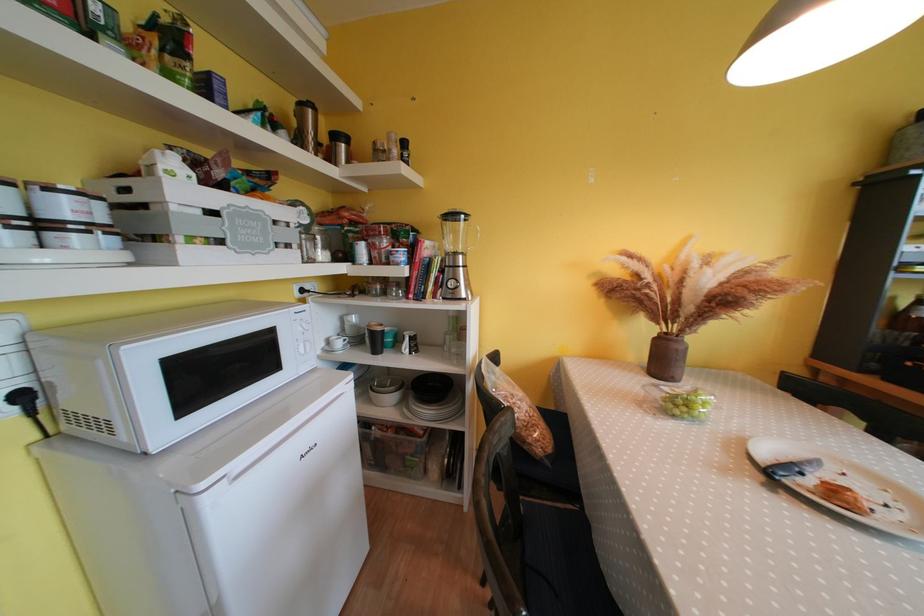
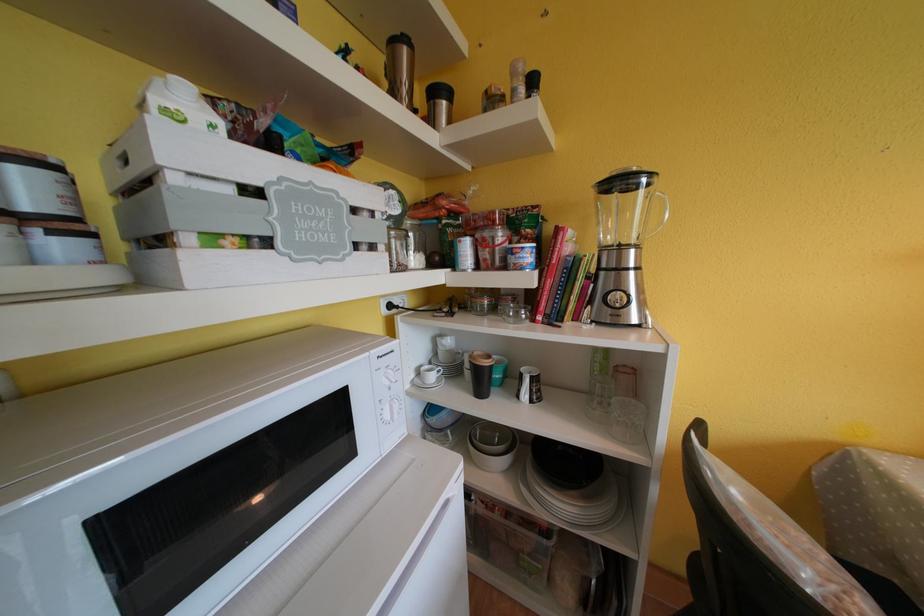
Question: Based on the continuous images, in which direction is the camera rotating? Reply with the corresponding letter.

Choices:
 (A) Left
 (B) Right
 (C) Up
 (D) Down

Answer: (A)